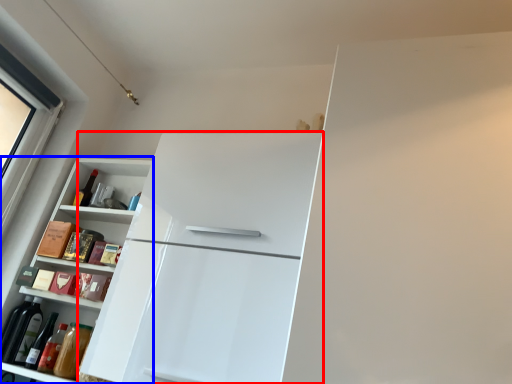
Question: Among these objects, which one is farthest to the camera, refrigerator (highlighted by a red box) or cabinetry (highlighted by a blue box)?

Choices:
 (A) refrigerator
 (B) cabinetry

Answer: (B)